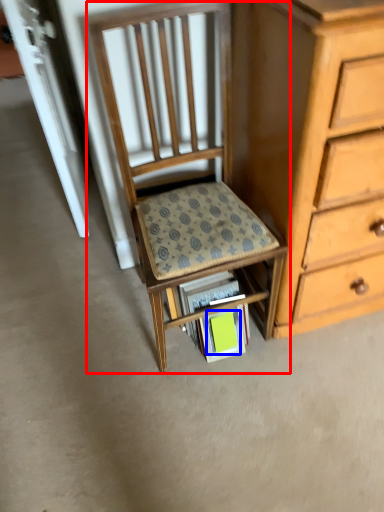
Question: Which object is closer to the camera taking this photo, chair (highlighted by a red box) or paperback book (highlighted by a blue box)?

Choices:
 (A) chair
 (B) paperback book

Answer: (A)